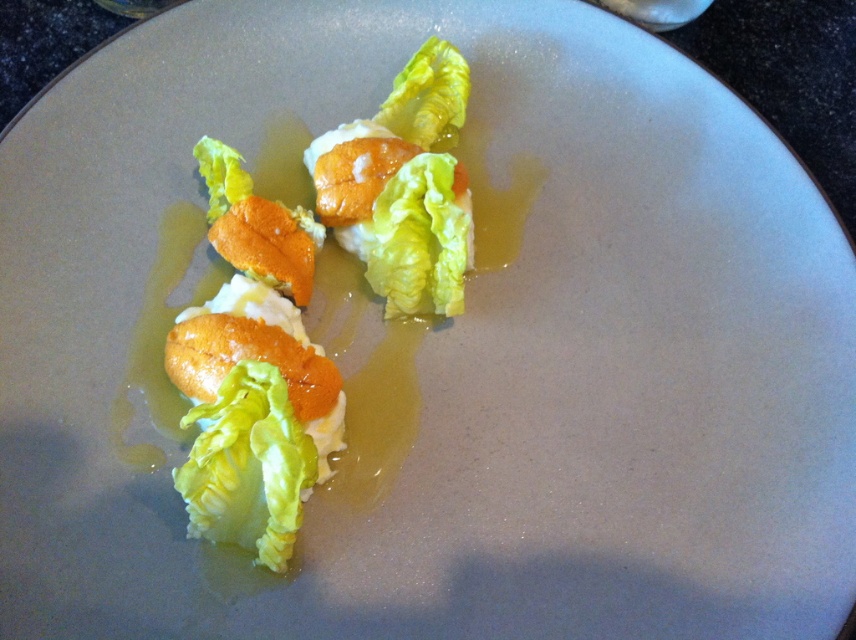
You are a food stylist arranging a dish with matte orange lettuce at center and green leafy lettuce at center. Which of the two has a greater width?

The matte orange lettuce at center has a greater width than the green leafy lettuce at center.

You are a food critic sitting at a table with this plate in front of you. You want to pick up the matte orange lettuce at center with your fingers. Can you reach it without moving your chair?

The matte orange lettuce at center is 1.18 meters from viewer, so yes, you can reach it without moving your chair since the average human arm span is about 1.5 meters.

You are a food critic analyzing the dish on the plate. You notice two items at the center of the plate. Which one is larger in size between the matte orange lettuce at center and the green leafy lettuce at center?

The matte orange lettuce at center is bigger than the green leafy lettuce at center.